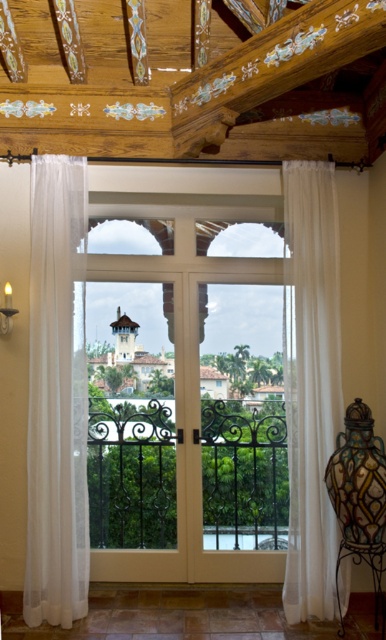
Question: Which point appears closest to the camera in this image?

Choices:
 (A) (35, 20)
 (B) (314, 259)
 (C) (196, 403)

Answer: (A)

Question: Does white sheer curtains at center have a smaller size compared to white wood screen door at center?

Choices:
 (A) no
 (B) yes

Answer: (A)

Question: Which object is farther from the camera taking this photo?

Choices:
 (A) white sheer curtain at right
 (B) sheer white curtain at left

Answer: (A)

Question: Can you confirm if sheer white curtain at left is wider than white wood screen door at center?

Choices:
 (A) no
 (B) yes

Answer: (A)

Question: In this image, where is white sheer curtains at center located relative to sheer white curtain at left?

Choices:
 (A) below
 (B) above

Answer: (B)

Question: Which object appears closest to the camera in this image?

Choices:
 (A) white sheer curtains at center
 (B) white wood screen door at center

Answer: (A)